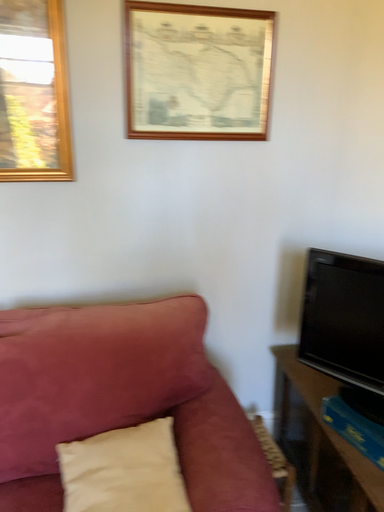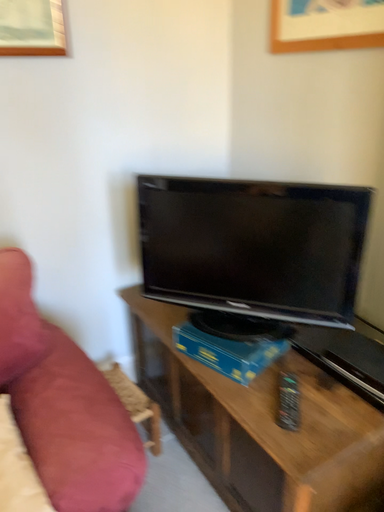
Question: How did the camera likely rotate when shooting the video?

Choices:
 (A) rotated right
 (B) rotated left

Answer: (A)